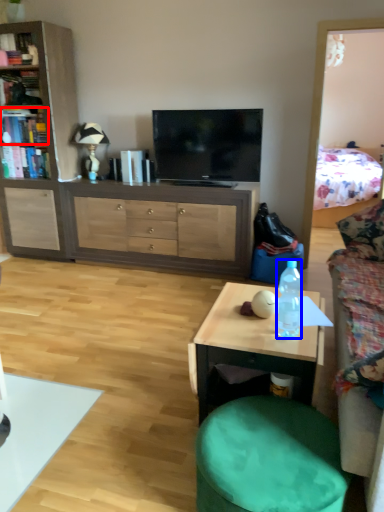
Question: Which point is further to the camera, book (highlighted by a red box) or bottle (highlighted by a blue box)?

Choices:
 (A) book
 (B) bottle

Answer: (A)